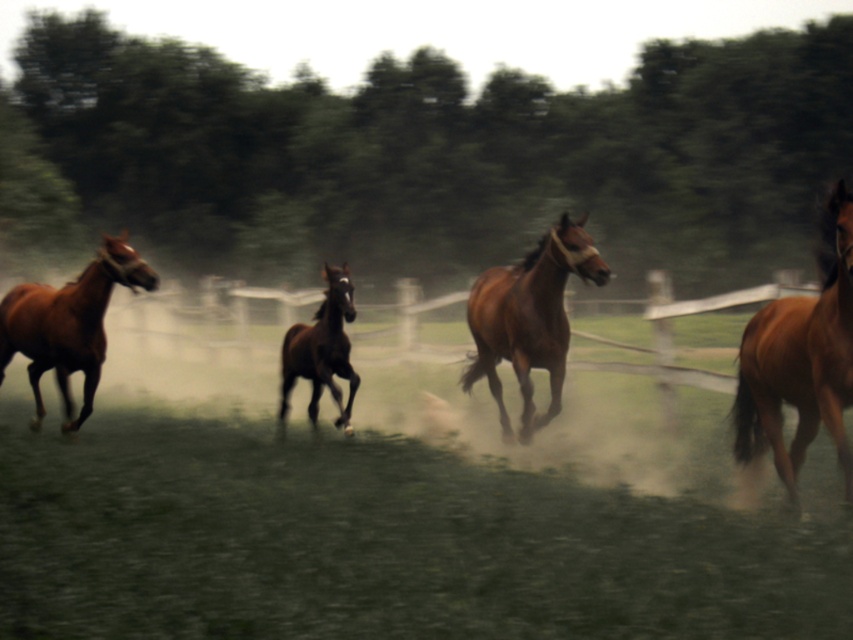
You are a photographer trying to capture a clear shot of both the shiny brown horse at left and the shiny brown horse at center. Since you can only focus on one horse at a time, which horse should you focus on to ensure the other remains in the background?

You should focus on the shiny brown horse at left because the shiny brown horse at center is behind it, making the left horse the foreground subject and the center horse naturally appear in the background.

You are a photographer trying to capture the horses in the image. You want to ensure that both the shiny brown horse at left and the shiny brown horse at center are in focus. Based on their sizes in the image, which horse should you focus on first to ensure clarity?

The shiny brown horse at left is smaller than the shiny brown horse at center, so you should focus on the shiny brown horse at center first because it is larger and more prominent in the frame.